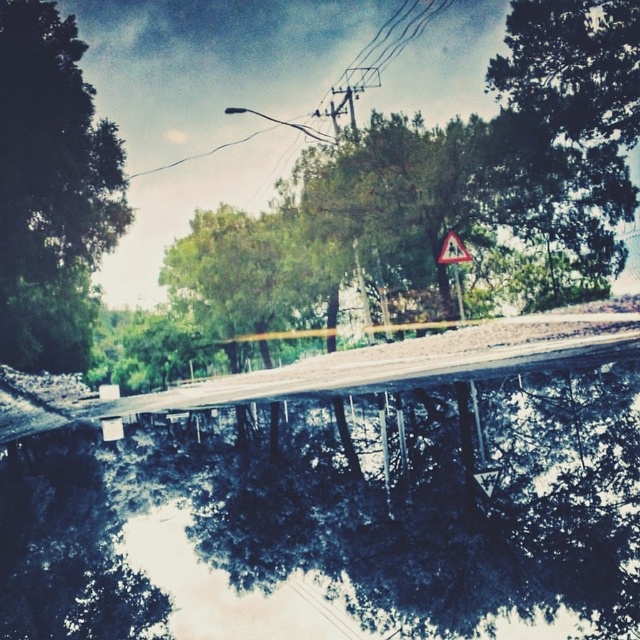
Can you confirm if green leafy tree at upper right is positioned above metallic wire at upper center?

No.

The width and height of the screenshot is (640, 640). What do you see at coordinates (573, 68) in the screenshot?
I see `green leafy tree at upper right` at bounding box center [573, 68].

Does point (497, 65) come closer to viewer compared to point (252, 132)?

Yes, it is in front of point (252, 132).

Find the location of a particular element. The width and height of the screenshot is (640, 640). green leafy tree at upper right is located at coordinates [573, 68].

Who is more distant from viewer, (392, 56) or (449, 256)?

The point (392, 56) is more distant.

At what (x,y) coordinates should I click in order to perform the action: click on metallic wire at upper center. Please return your answer as a coordinate pair (x, y). Looking at the image, I should click on (387, 44).

Between point (340, 596) and point (45, 228), which one is positioned behind?

Point (45, 228)

The height and width of the screenshot is (640, 640). Identify the location of dark reflective water at center. (339, 516).